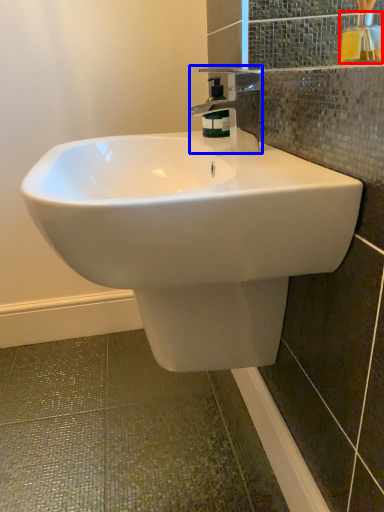
Question: Which of the following is the farthest to the observer, mouthwash (highlighted by a red box) or tap (highlighted by a blue box)?

Choices:
 (A) mouthwash
 (B) tap

Answer: (A)